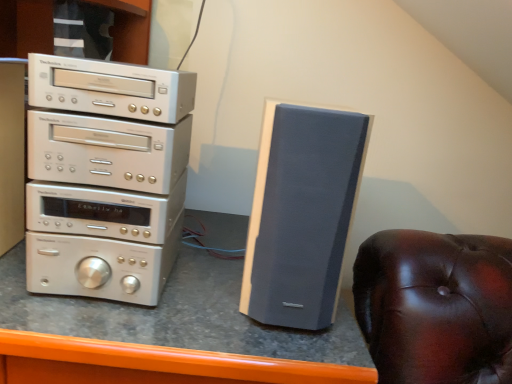
Describe the element at coordinates (105, 177) in the screenshot. The height and width of the screenshot is (384, 512). I see `silver metallic stereo stack at left` at that location.

The width and height of the screenshot is (512, 384). Describe the element at coordinates (167, 334) in the screenshot. I see `matte gray speaker at center` at that location.

What are the coordinates of `matte gray speaker at right` in the screenshot? It's located at (301, 214).

From the picture: Considering the relative positions of silver metallic stereo stack at left and matte gray speaker at center in the image provided, is silver metallic stereo stack at left behind matte gray speaker at center?

Yes, silver metallic stereo stack at left is further from the viewer.

Would you consider silver metallic stereo stack at left to be distant from matte gray speaker at center?

That's not correct — silver metallic stereo stack at left is a little close to matte gray speaker at center.

From a real-world perspective, does silver metallic stereo stack at left sit lower than matte gray speaker at center?

Incorrect, from a real-world perspective, silver metallic stereo stack at left is higher than matte gray speaker at center.

From the image's perspective, would you say silver metallic stereo stack at left is positioned over matte gray speaker at center?

Correct, silver metallic stereo stack at left appears higher than matte gray speaker at center in the image.

Based on their sizes in the image, would you say matte gray speaker at right is bigger or smaller than silver metallic stereo stack at left?

In the image, matte gray speaker at right appears to be smaller than silver metallic stereo stack at left.

This screenshot has height=384, width=512. Find the location of `speaker on the right of silver metallic stereo stack at left`. speaker on the right of silver metallic stereo stack at left is located at coordinates (301, 214).

In terms of width, does matte gray speaker at right look wider or thinner when compared to silver metallic stereo stack at left?

Clearly, matte gray speaker at right has more width compared to silver metallic stereo stack at left.

From a real-world perspective, is silver metallic stereo stack at left under matte gray speaker at right?

Actually, silver metallic stereo stack at left is physically above matte gray speaker at right in the real world.

Which object is positioned more to the right, silver metallic stereo stack at left or matte gray speaker at right?

matte gray speaker at right.

Is silver metallic stereo stack at left not close to matte gray speaker at right?

No, silver metallic stereo stack at left is not far from matte gray speaker at right.

Considering the points (166, 379) and (178, 185), which point is behind, point (166, 379) or point (178, 185)?

The point (178, 185) is more distant.

Can you confirm if matte gray speaker at center is smaller than silver metallic stereo stack at left?

No.

Is matte gray speaker at center beside silver metallic stereo stack at left?

matte gray speaker at center and silver metallic stereo stack at left are clearly separated.

From a real-world perspective, is matte gray speaker at center over silver metallic stereo stack at left?

No, from a real-world perspective, matte gray speaker at center is not above silver metallic stereo stack at left.

Which point is more forward, (x=254, y=371) or (x=287, y=284)?

Point (x=254, y=371)

Looking at this image, does matte gray speaker at center have a smaller size compared to matte gray speaker at right?

Actually, matte gray speaker at center might be larger than matte gray speaker at right.

Which object is more forward, matte gray speaker at center or matte gray speaker at right?

Positioned in front is matte gray speaker at center.

Is matte gray speaker at center wider than matte gray speaker at right?

Correct, the width of matte gray speaker at center exceeds that of matte gray speaker at right.

Could you tell me if matte gray speaker at right is facing matte gray speaker at center?

No.

Can you confirm if matte gray speaker at right is positioned to the right of matte gray speaker at center?

Indeed, matte gray speaker at right is positioned on the right side of matte gray speaker at center.

Is matte gray speaker at center surrounded by matte gray speaker at right?

No.

How different are the orientations of matte gray speaker at right and matte gray speaker at center in degrees?

0.61 degrees.

Identify the location of computer desk below the silver metallic stereo stack at left (from the image's perspective). (167, 334).

I want to click on home appliance positioned vertically above the matte gray speaker at right (from a real-world perspective), so click(105, 177).

Estimate the real-world distances between objects in this image. Which object is closer to matte gray speaker at right, silver metallic stereo stack at left or matte gray speaker at center?

matte gray speaker at center is closer to matte gray speaker at right.

From the image, which object appears to be farther from silver metallic stereo stack at left, matte gray speaker at center or matte gray speaker at right?

matte gray speaker at right.

Considering their positions, is matte gray speaker at center positioned further to matte gray speaker at right than silver metallic stereo stack at left?

silver metallic stereo stack at left is positioned further to the anchor matte gray speaker at right.

From the image, which object appears to be farther from matte gray speaker at center, matte gray speaker at right or silver metallic stereo stack at left?

matte gray speaker at right is positioned further to the anchor matte gray speaker at center.

Which object lies nearer to the anchor point silver metallic stereo stack at left, matte gray speaker at right or matte gray speaker at center?

Based on the image, matte gray speaker at center appears to be nearer to silver metallic stereo stack at left.

Considering their positions, is silver metallic stereo stack at left positioned further to matte gray speaker at center than matte gray speaker at right?

Based on the image, matte gray speaker at right appears to be further to matte gray speaker at center.

I want to click on speaker between silver metallic stereo stack at left and matte gray speaker at center in the vertical direction, so click(x=301, y=214).